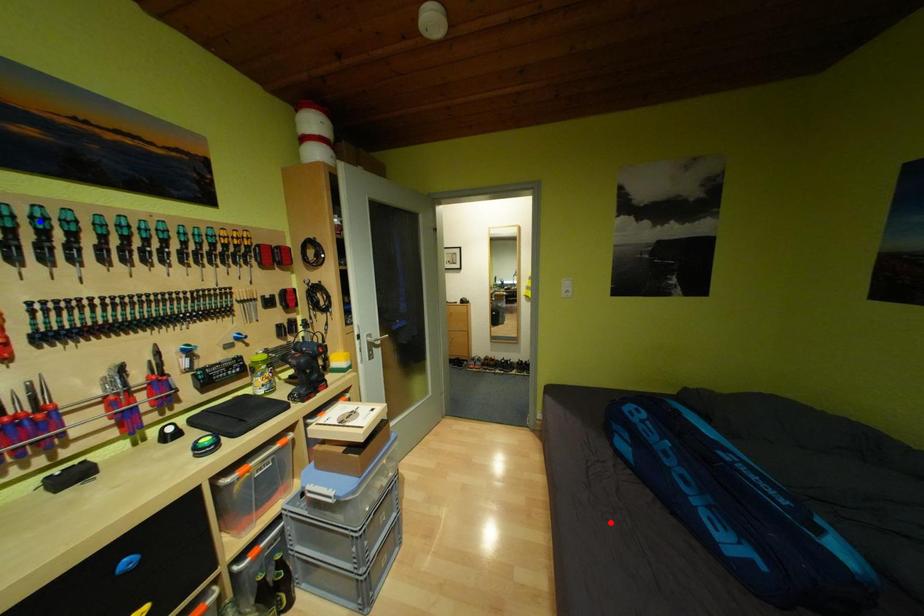
Question: Which of the two points in the image is closer to the camera?

Choices:
 (A) Blue point is closer.
 (B) Red point is closer.

Answer: (A)